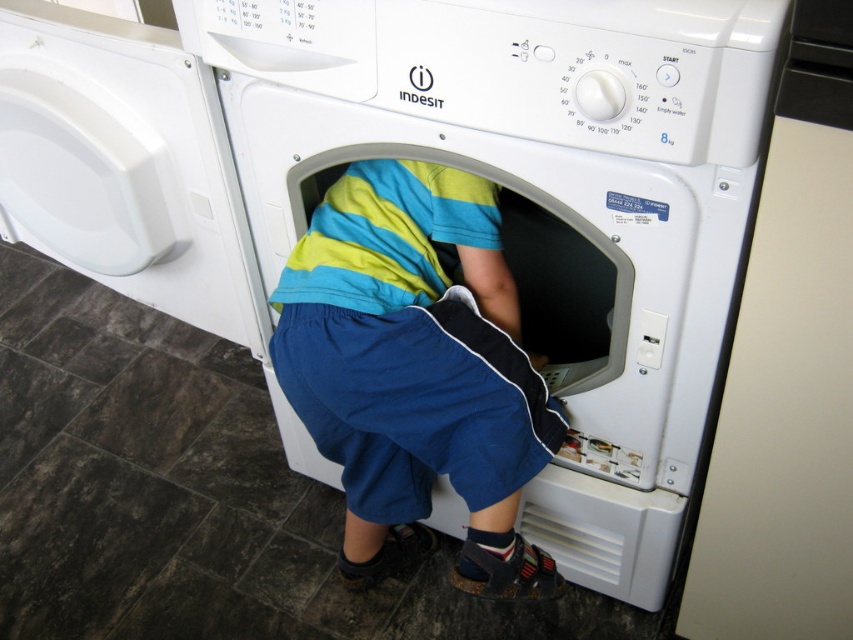
Does white plastic washing machine at center appear over white plastic washing machine at left?

No, white plastic washing machine at center is not above white plastic washing machine at left.

Which is in front, point (310, 179) or point (170, 157)?

Point (310, 179) is in front.

This screenshot has height=640, width=853. Identify the location of white plastic washing machine at center. (541, 204).

From the picture: Does blue cotton shorts at center appear on the right side of white plastic washing machine at left?

Indeed, blue cotton shorts at center is positioned on the right side of white plastic washing machine at left.

This screenshot has height=640, width=853. What do you see at coordinates (416, 369) in the screenshot?
I see `blue cotton shorts at center` at bounding box center [416, 369].

The width and height of the screenshot is (853, 640). I want to click on blue cotton shorts at center, so click(416, 369).

Which is below, white plastic washing machine at center or blue cotton shorts at center?

Positioned lower is blue cotton shorts at center.

Does white plastic washing machine at center appear on the right side of blue cotton shorts at center?

Yes, white plastic washing machine at center is to the right of blue cotton shorts at center.

Between point (532, 280) and point (450, 358), which one is positioned behind?

The point (532, 280) is behind.

Where is `white plastic washing machine at center`? white plastic washing machine at center is located at coordinates (541, 204).